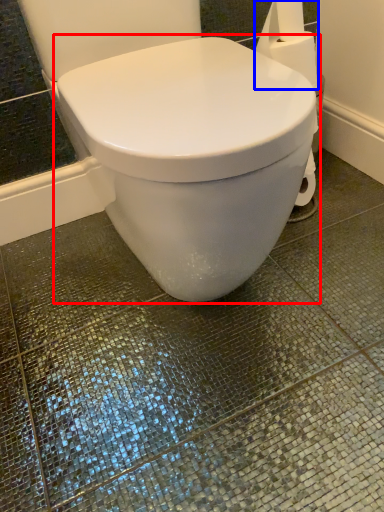
Question: Which of the following is the closest to the observer, toilet (highlighted by a red box) or toilet paper (highlighted by a blue box)?

Choices:
 (A) toilet
 (B) toilet paper

Answer: (A)